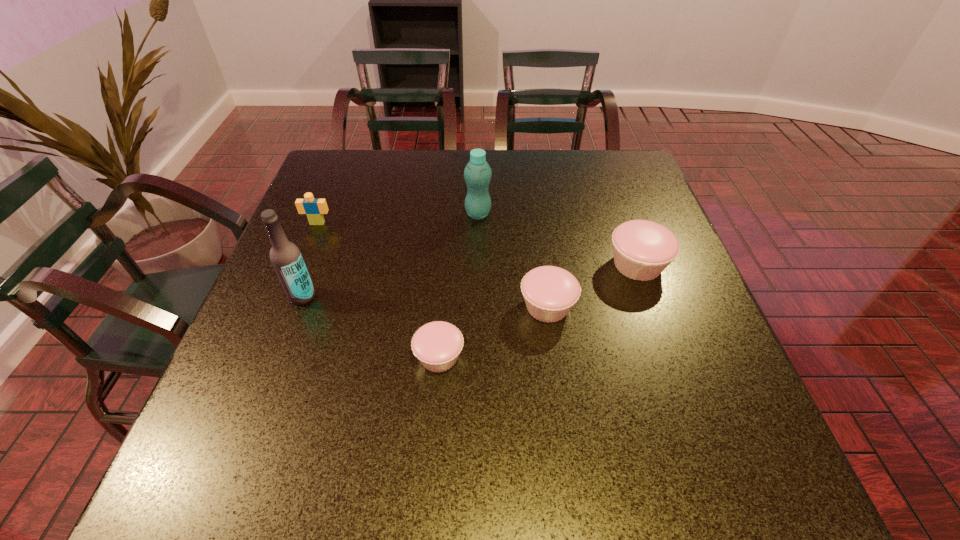
What are the coordinates of `free spot that satisfies the following two spatial constraints: 1. on the face of the tallest cupcake; 2. on the left side of the Lego` in the screenshot? It's located at (300, 265).

The width and height of the screenshot is (960, 540). Find the location of `vacant area in the image that satisfies the following two spatial constraints: 1. at the front cap of the fifth shortest object; 2. on the label of the beer bottle`. vacant area in the image that satisfies the following two spatial constraints: 1. at the front cap of the fifth shortest object; 2. on the label of the beer bottle is located at coordinates (477, 296).

Where is `free location that satisfies the following two spatial constraints: 1. on the label of the beer bottle; 2. on the left side of the second shortest cupcake`? free location that satisfies the following two spatial constraints: 1. on the label of the beer bottle; 2. on the left side of the second shortest cupcake is located at coordinates (299, 306).

Image resolution: width=960 pixels, height=540 pixels. I want to click on free space that satisfies the following two spatial constraints: 1. at the front cap of the water bottle; 2. on the face of the Lego, so click(478, 223).

At what (x,y) coordinates should I click in order to perform the action: click on free spot that satisfies the following two spatial constraints: 1. at the front cap of the water bottle; 2. on the front side of the nearest cupcake. Please return your answer as a coordinate pair (x, y). This screenshot has width=960, height=540. Looking at the image, I should click on (477, 357).